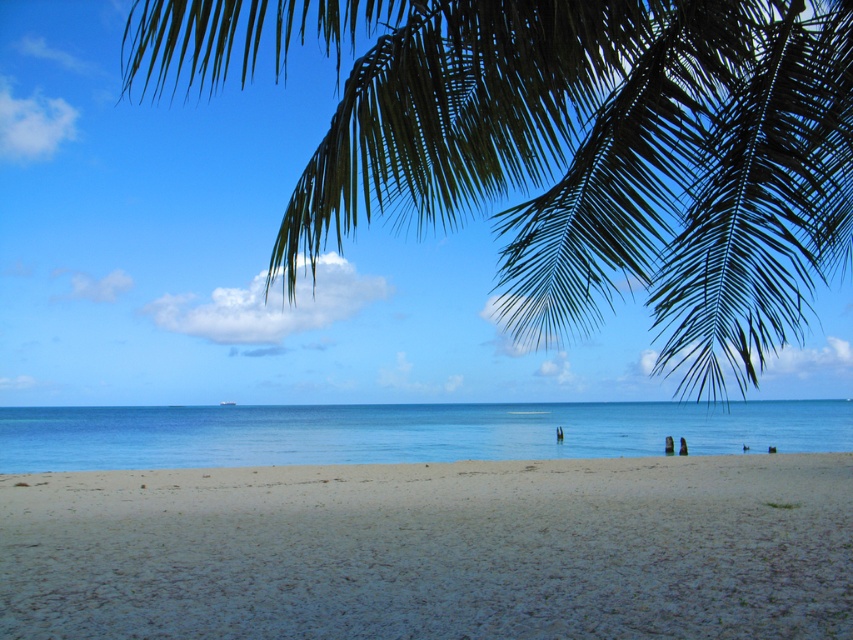
Question: Can you confirm if light brown sandy beach at lower center is wider than blue water at center?

Choices:
 (A) yes
 (B) no

Answer: (B)

Question: Is green leafy palm at upper center bigger than blue water at center?

Choices:
 (A) yes
 (B) no

Answer: (A)

Question: Is green leafy palm at upper center wider than light brown sandy beach at lower center?

Choices:
 (A) yes
 (B) no

Answer: (B)

Question: Among these points, which one is nearest to the camera?

Choices:
 (A) (306, 448)
 (B) (305, 211)

Answer: (B)

Question: Which object is the closest to the light brown sandy beach at lower center?

Choices:
 (A) green leafy palm at upper center
 (B) blue water at center

Answer: (A)

Question: Among these points, which one is farthest from the camera?

Choices:
 (A) (740, 406)
 (B) (843, 65)
 (C) (407, 524)

Answer: (A)